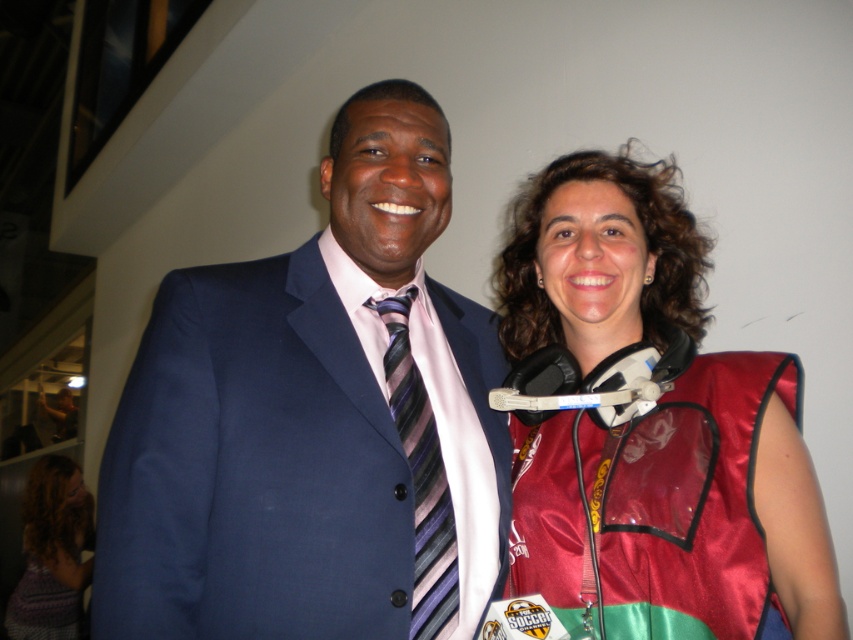
You are a photographer trying to capture a group photo. You need to ensure that the matte blue suit at center and the satin red vest at right are both visible in the frame. Based on their positions, which direction should you position the camera relative to the subjects to include both in the shot?

Since the matte blue suit at center is to the left of the satin red vest at right, you should position the camera so that it faces the subjects from the front, ensuring both the left and right sides are captured in the frame.

You are a photographer who needs to adjust the lighting for a group photo. You notice the satin red vest at right and the knitted purple sweater at lower left. Which object is positioned more to the east in the image?

The satin red vest at right is positioned more to the east because it is to the right of the knitted purple sweater at lower left, and in the image, right typically corresponds to east.